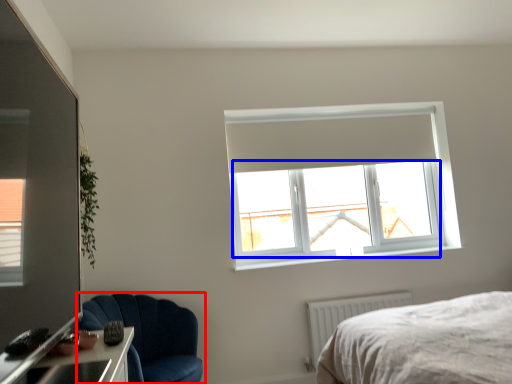
Question: Which object is further to the camera taking this photo, chair (highlighted by a red box) or window screen (highlighted by a blue box)?

Choices:
 (A) chair
 (B) window screen

Answer: (B)